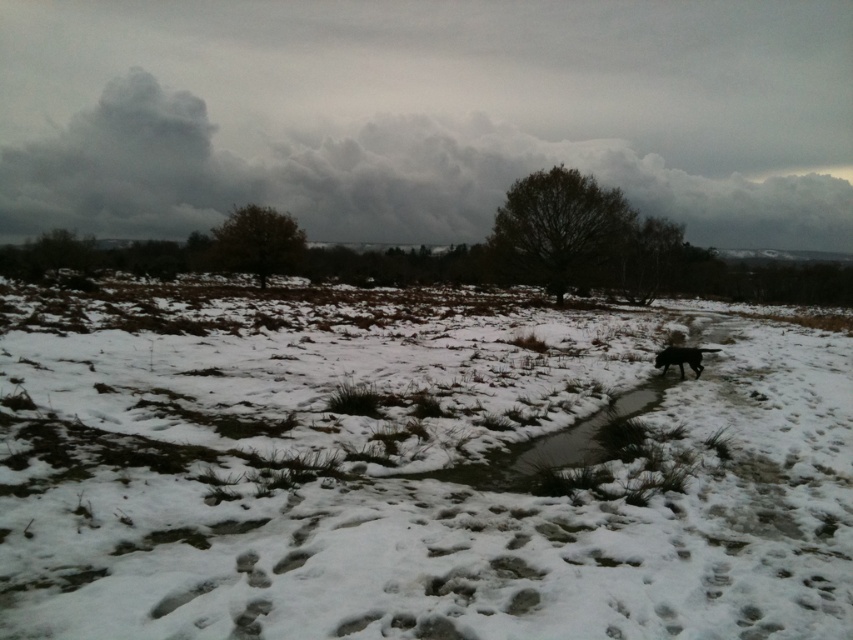
What do you see at coordinates (410, 468) in the screenshot? The image size is (853, 640). I see `white fluffy snow at center` at bounding box center [410, 468].

Looking at this image, between white fluffy snow at center and black matte dog at right, which one has more height?

With more height is white fluffy snow at center.

Between point (469, 564) and point (671, 353), which one is positioned behind?

The point (671, 353) is behind.

Locate an element on the screen. white fluffy snow at center is located at coordinates (410, 468).